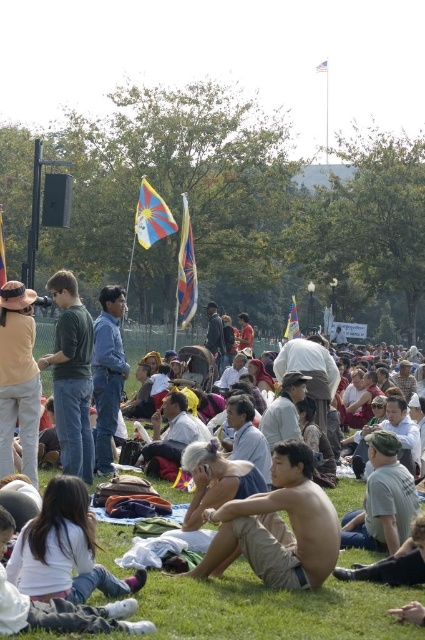
Question: Which point is closer to the camera?

Choices:
 (A) green cotton shirt at center
 (B) tan shorts at center

Answer: (B)

Question: Which object is the farthest from the tan cotton shirt at center?

Choices:
 (A) green cotton shirt at center
 (B) tan shorts at center

Answer: (A)

Question: Can you confirm if tan shorts at center is smaller than green cotton shirt at center?

Choices:
 (A) no
 (B) yes

Answer: (B)

Question: Which point is closer to the camera taking this photo?

Choices:
 (A) (260, 524)
 (B) (186, 614)
 (C) (85, 312)

Answer: (B)

Question: Is tan shorts at center closer to the viewer compared to green cotton shirt at center?

Choices:
 (A) no
 (B) yes

Answer: (B)

Question: Can you confirm if tan cotton shirt at center is smaller than tan shorts at center?

Choices:
 (A) no
 (B) yes

Answer: (A)